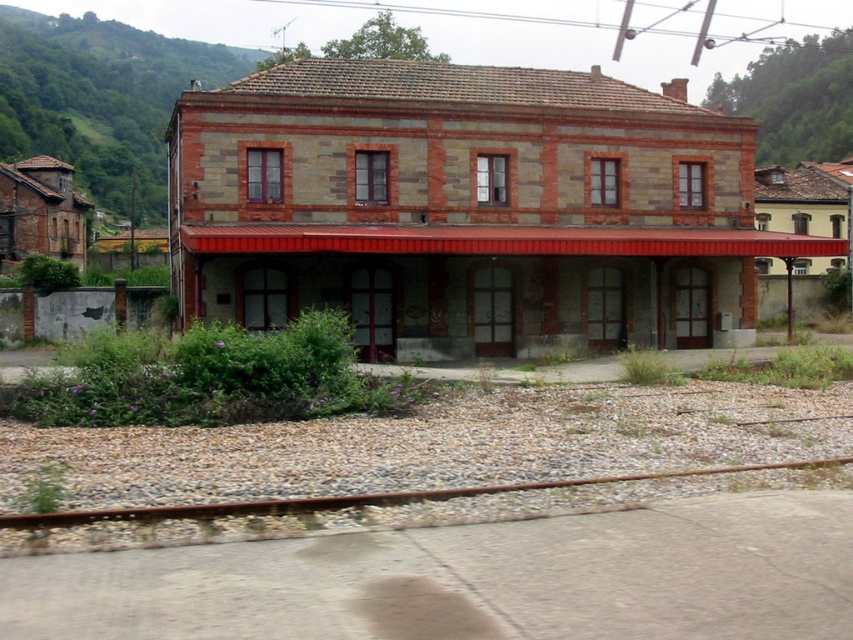
Is brick railway station at center thinner than rusty metal train track at lower center?

Incorrect, brick railway station at center's width is not less than rusty metal train track at lower center's.

Locate an element on the screen. brick railway station at center is located at coordinates click(x=467, y=209).

Does green grassy hillside at upper left have a smaller size compared to rusty metal train track at lower center?

Incorrect, green grassy hillside at upper left is not smaller in size than rusty metal train track at lower center.

Which is in front, point (178, 38) or point (199, 508)?

Point (199, 508) is in front.

This screenshot has height=640, width=853. In order to click on green grassy hillside at upper left in this screenshot , I will do `click(102, 99)`.

Is brick railway station at center to the left of green grassy hillside at upper left from the viewer's perspective?

In fact, brick railway station at center is to the right of green grassy hillside at upper left.

The width and height of the screenshot is (853, 640). What do you see at coordinates (467, 209) in the screenshot?
I see `brick railway station at center` at bounding box center [467, 209].

Find the location of a particular element. Image resolution: width=853 pixels, height=640 pixels. brick railway station at center is located at coordinates [467, 209].